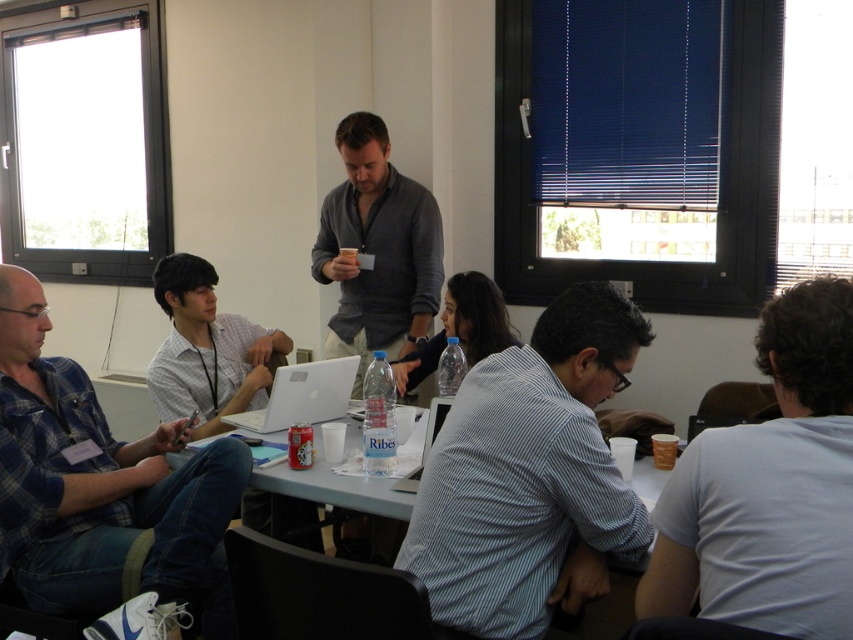
You are a photographer in the room and want to take a picture of both the striped cotton shirt at center and the white glossy shirt at center. Which shirt should you focus on first if you want to capture them both clearly in the frame?

You should focus on the white glossy shirt at center first because the striped cotton shirt at center is positioned to its right, so adjusting focus from left to right would ensure both are in frame.

You are organizing a photo shoot and need to place a small prop between the striped cotton shirt at center and the white glossy shirt at center. Given their sizes, which shirt should the prop be placed closer to?

The striped cotton shirt at center has a smaller size compared to the white glossy shirt at center. Therefore, the prop should be placed closer to the white glossy shirt at center to ensure visibility and balance.

You are a photographer standing behind the table. You want to take a photo of the gray cotton shirt at center without the white cotton shirt at lower right blocking it. What should you do?

Move to the side so that the gray cotton shirt at center is no longer behind the white cotton shirt at lower right.